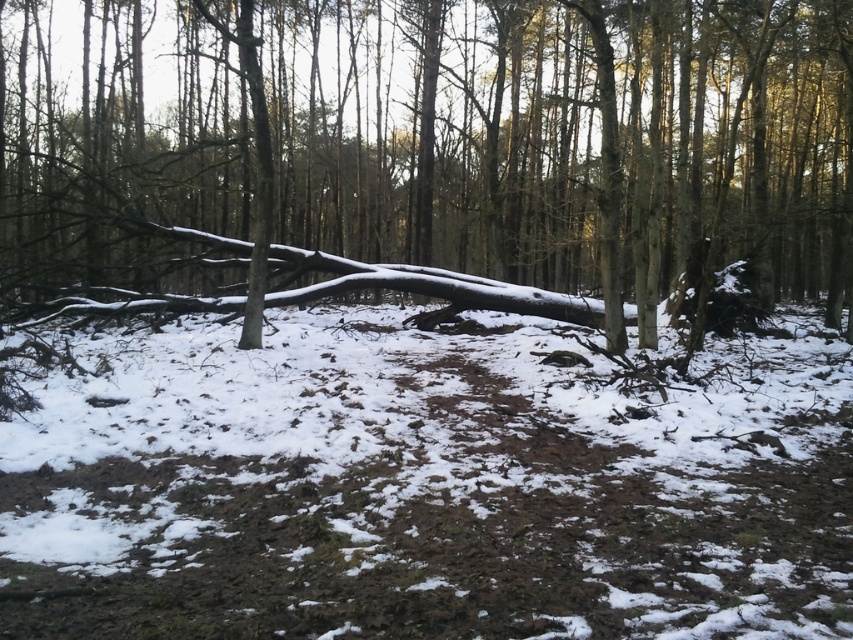
Does snow-covered log at center have a lesser height compared to white powdery snow at center?

No.

Does snow-covered log at center have a greater width compared to white powdery snow at center?

Correct, the width of snow-covered log at center exceeds that of white powdery snow at center.

Which is behind, point (619, 106) or point (91, 404)?

Point (619, 106)

I want to click on snow-covered log at center, so [437, 157].